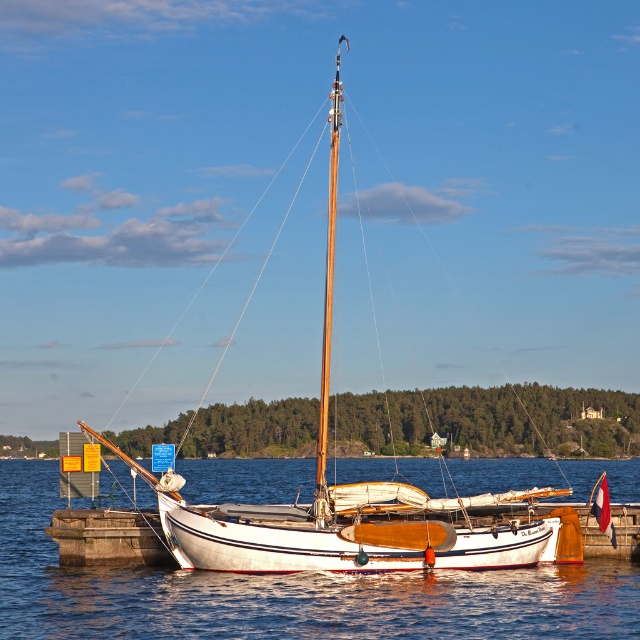
Question: Which object is closer to the camera taking this photo?

Choices:
 (A) white wood sailboat at center
 (B) white smooth water at center

Answer: (B)

Question: Is white smooth water at center below white wood sailboat at center?

Choices:
 (A) yes
 (B) no

Answer: (A)

Question: Does white smooth water at center have a lesser width compared to white wood sailboat at center?

Choices:
 (A) yes
 (B) no

Answer: (B)

Question: Can you confirm if white smooth water at center is smaller than white wood sailboat at center?

Choices:
 (A) no
 (B) yes

Answer: (B)